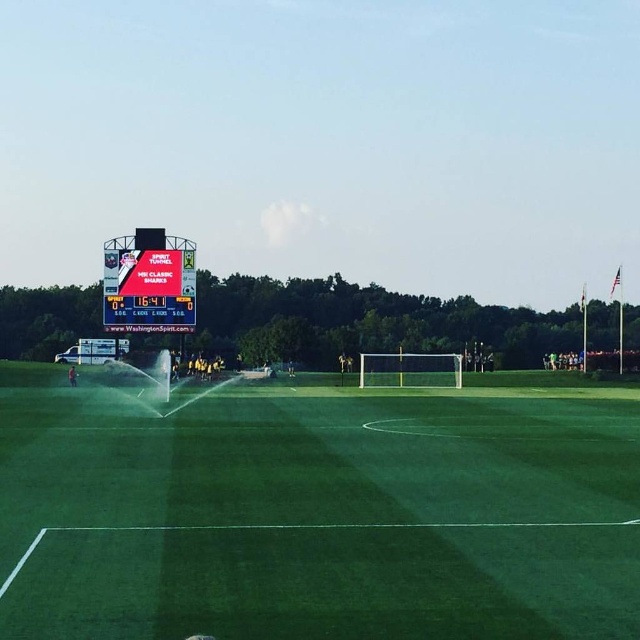
Consider the image. You are a photographer standing at the edge of the soccer field. You want to take a photo that includes both the green artificial turf at center and the white plastic scoreboard at upper left. Which object should you position closer to the front of your camera frame?

The green artificial turf at center should be positioned closer to the front of your camera frame because it is in front of the white plastic scoreboard at upper left.

You are a soccer player standing at the point with coordinates point (32,618). You need to pass the ball to a teammate located at point (145,300). Will your pass go directly to them without any obstruction from the scoreboard?

Yes, the pass from point (32,618) to point (145,300) will go directly because point (32,618) is in front of point (145,300), meaning there is a clear line of sight between them.

You are a groundskeeper checking the soccer field. You notice the green artificial turf at center and the white plastic scoreboard at upper left. Which object is taller?

The white plastic scoreboard at upper left is taller than the green artificial turf at center.